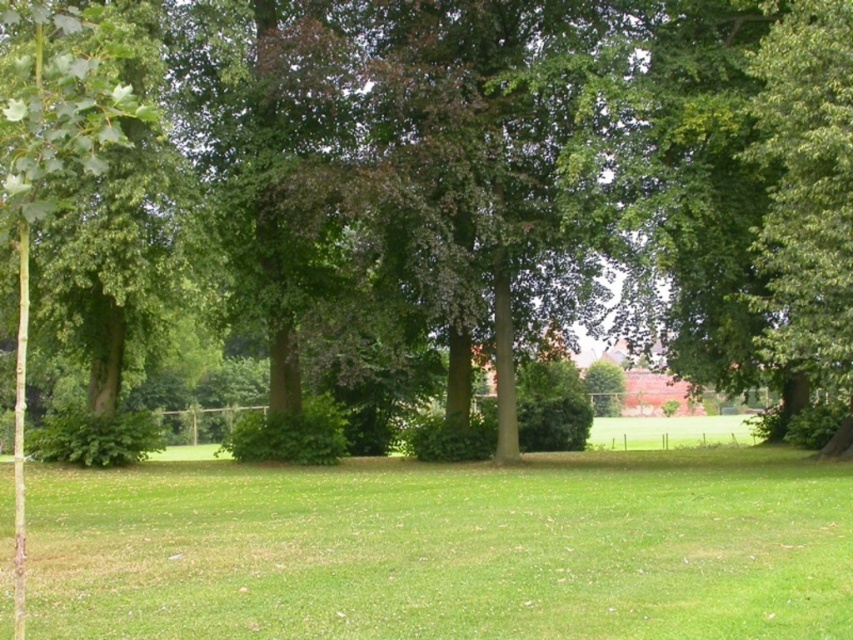
Can you confirm if green leafy tree at center is positioned below green grass at center?

Actually, green leafy tree at center is above green grass at center.

Who is more distant from viewer, (792, 324) or (283, 634)?

Positioned behind is point (792, 324).

Which is behind, point (274, 173) or point (657, 621)?

The point (274, 173) is more distant.

The image size is (853, 640). Identify the location of green leafy tree at center. (590, 154).